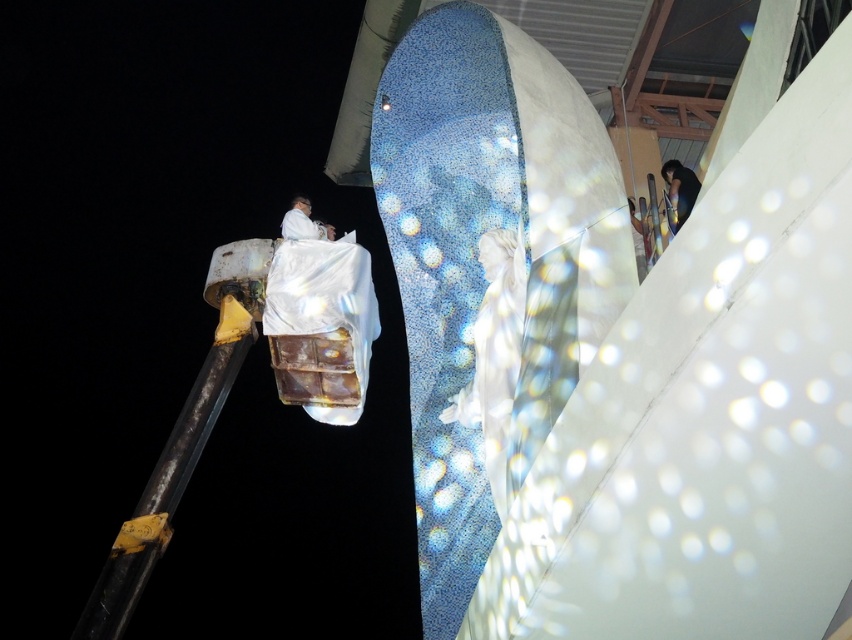
Question: Which is nearer to the white matte suit at upper center?

Choices:
 (A) rusty metal pole at left
 (B) white glossy statue at center
 (C) dark hair at upper right
 (D) white fabric at upper right

Answer: (A)

Question: Which point appears farthest from the camera in this image?

Choices:
 (A) (295, 221)
 (B) (634, 220)

Answer: (A)

Question: Which point is farther to the camera?

Choices:
 (A) (315, 234)
 (B) (453, 413)
 (C) (645, 268)
 (D) (671, 186)

Answer: (A)

Question: Does dark hair at upper right have a larger size compared to white matte suit at upper center?

Choices:
 (A) yes
 (B) no

Answer: (B)

Question: Does rusty metal pole at left appear on the left side of white fabric at upper right?

Choices:
 (A) no
 (B) yes

Answer: (B)

Question: Does rusty metal pole at left appear on the left side of white matte suit at upper center?

Choices:
 (A) yes
 (B) no

Answer: (A)